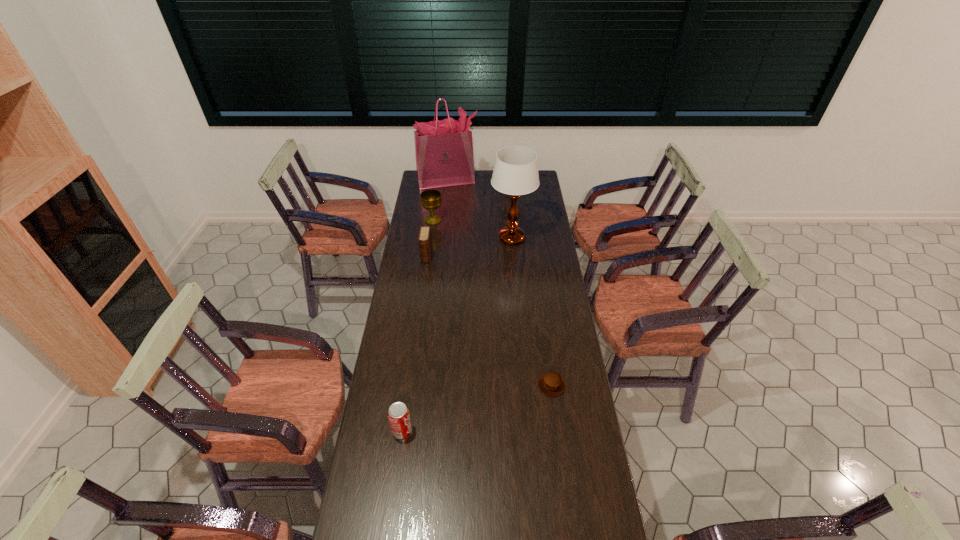
Locate an element on the screen. The height and width of the screenshot is (540, 960). vacant space located 0.280m on the spine side of the diary is located at coordinates (420, 305).

Image resolution: width=960 pixels, height=540 pixels. I want to click on free space located on the right of the nearest object, so click(x=497, y=430).

The height and width of the screenshot is (540, 960). In order to click on vacant position located 0.180m on the back of the muffin in this screenshot , I will do `click(545, 337)`.

Locate an element on the screen. The image size is (960, 540). object located in the far edge section of the desktop is located at coordinates coord(444,156).

This screenshot has height=540, width=960. What are the coordinates of `shopping bag that is at the left edge` in the screenshot? It's located at (444, 156).

Locate an element on the screen. The image size is (960, 540). chalice positioned at the left edge is located at coordinates (430, 199).

Identify the location of diary that is positioned at the left edge. tap(425, 241).

Where is `soda can located at the left edge`? soda can located at the left edge is located at coordinates (399, 418).

Where is `table lamp located at the right edge`? table lamp located at the right edge is located at coordinates (515, 173).

Where is `muffin that is at the right edge`? muffin that is at the right edge is located at coordinates (552, 384).